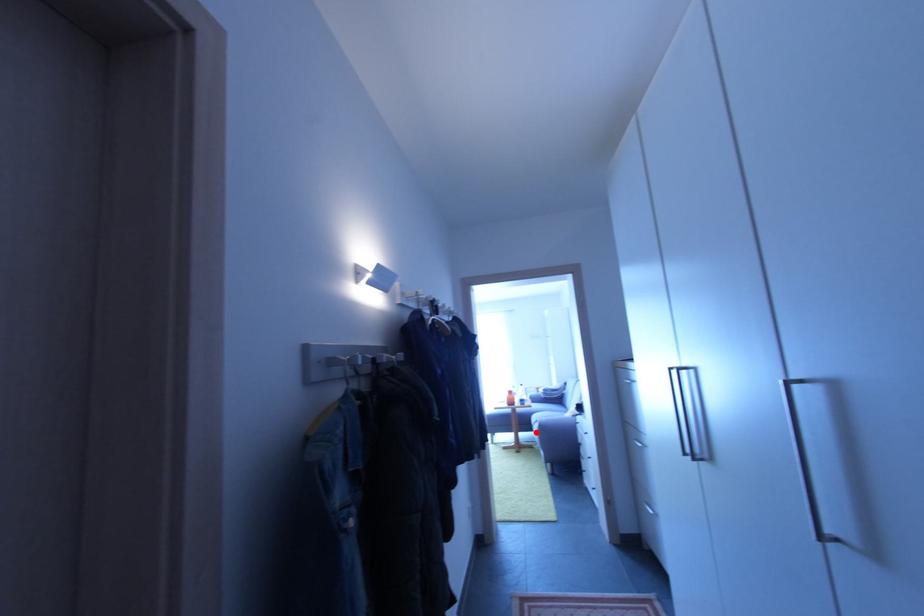
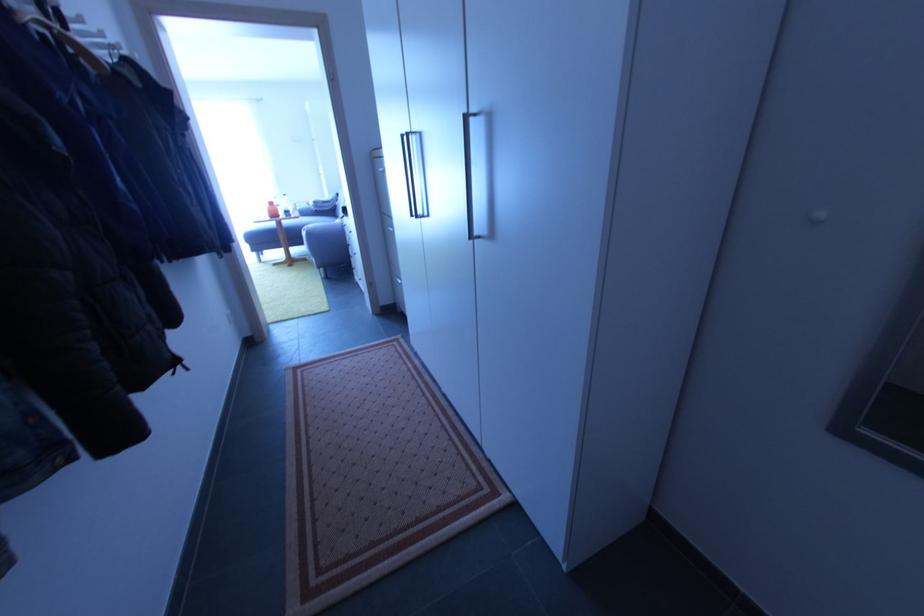
In the second image, find the point that corresponds to the highlighted location in the first image.

(308, 245)